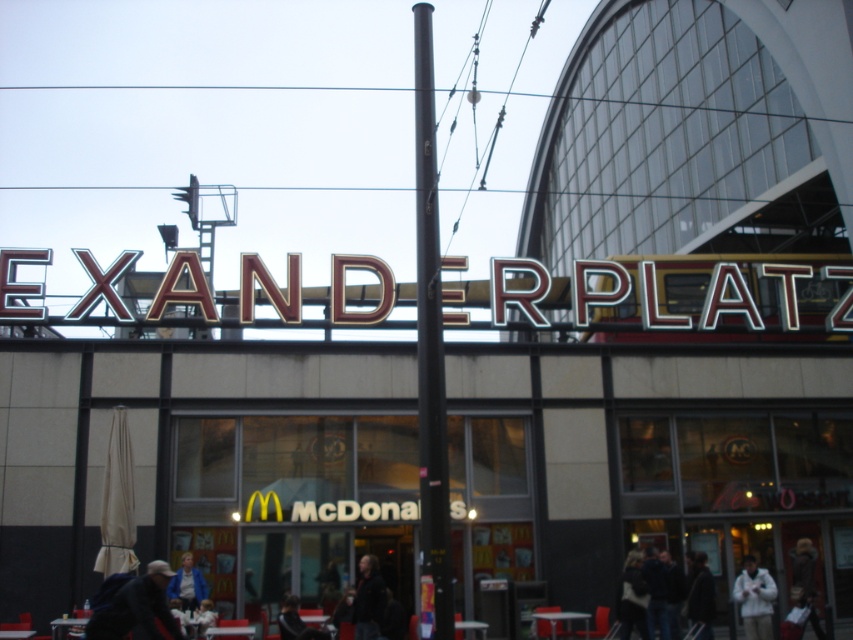
Question: Considering the real-world distances, which object is closest to the dark blue jacket at lower right?

Choices:
 (A) dark blue jacket at lower left
 (B) dark gray jacket at lower center

Answer: (B)

Question: Based on their relative distances, which object is farther from the dark blue jacket at lower left?

Choices:
 (A) dark gray jacket at lower center
 (B) metallic gold sign at upper center
 (C) white matte jacket at lower right

Answer: (C)

Question: Can you confirm if black metal pole at center is bigger than dark gray jacket at lower center?

Choices:
 (A) yes
 (B) no

Answer: (A)

Question: From the image, what is the correct spatial relationship of metallic gold sign at upper center in relation to dark blue jacket at lower right?

Choices:
 (A) left
 (B) right

Answer: (A)

Question: Does white matte jacket at lower right appear under dark brown fur coat at lower right?

Choices:
 (A) yes
 (B) no

Answer: (A)

Question: Estimate the real-world distances between objects in this image. Which object is farther from the dark hair at center?

Choices:
 (A) dark blue jacket at lower right
 (B) blue fabric jacket at center
 (C) dark brown fur coat at lower right

Answer: (C)